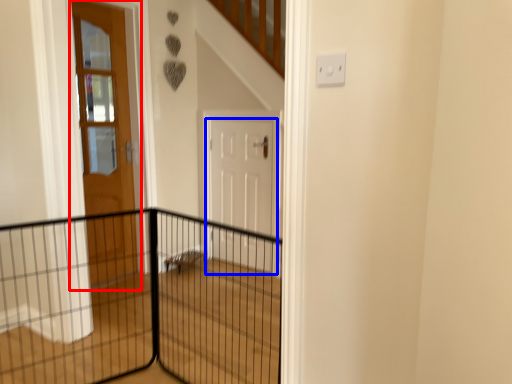
Question: Which object appears farthest to the camera in this image, door (highlighted by a red box) or door (highlighted by a blue box)?

Choices:
 (A) door
 (B) door

Answer: (B)